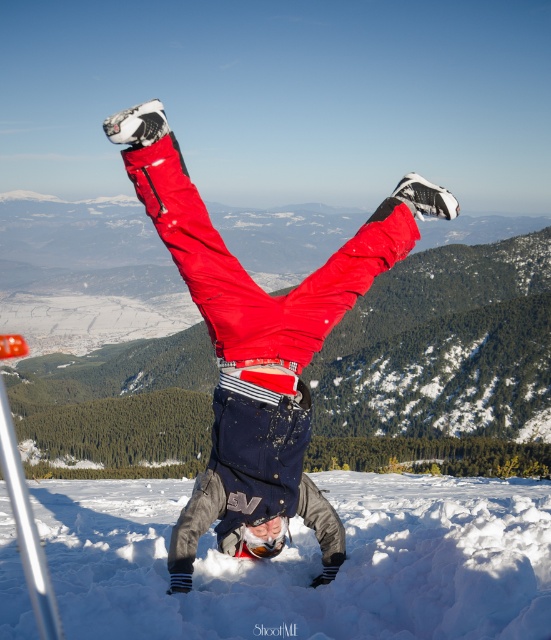
Based on the scene description, where is the white fluffy snow at center located in terms of its 2D coordinates?

The white fluffy snow at center is located at the 2D coordinates of point (306, 563).

You are a photographer trying to capture the perfect shot of the scene. The white fluffy snow at center and the matte red pants at center are both in your viewfinder. Based on their heights, which object should appear lower in the photo?

The white fluffy snow at center has a lesser height compared to the matte red pants at center, so it will appear lower in the photo.